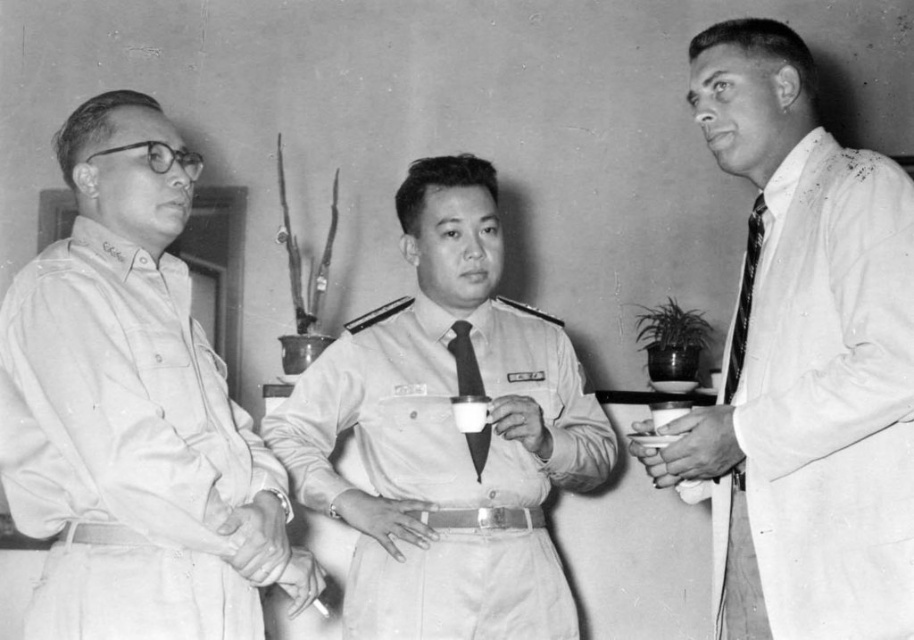
Question: Estimate the real-world distances between objects in this image. Which object is farther from the striped fabric tie at right?

Choices:
 (A) white smooth coat at right
 (B) black silk tie at center
 (C) matte khaki shirt at left
 (D) light khaki fabric uniform at center

Answer: (C)

Question: Can you confirm if matte khaki shirt at left is smaller than striped fabric tie at right?

Choices:
 (A) no
 (B) yes

Answer: (A)

Question: Which point is farther to the camera?

Choices:
 (A) white smooth coat at right
 (B) light khaki fabric uniform at center
 (C) black silk tie at center
 (D) striped fabric tie at right

Answer: (B)

Question: Which is farther from the light khaki fabric uniform at center?

Choices:
 (A) white smooth coat at right
 (B) striped fabric tie at right
 (C) matte khaki shirt at left

Answer: (B)

Question: Is light khaki fabric uniform at center positioned behind striped fabric tie at right?

Choices:
 (A) no
 (B) yes

Answer: (B)

Question: Can you confirm if light khaki fabric uniform at center is bigger than black silk tie at center?

Choices:
 (A) no
 (B) yes

Answer: (B)